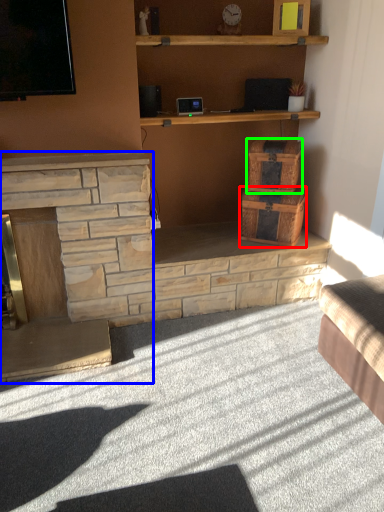
Question: Estimate the real-world distances between objects in this image. Which object is farther from drawer (highlighted by a red box), fireplace (highlighted by a blue box) or crate (highlighted by a green box)?

Choices:
 (A) fireplace
 (B) crate

Answer: (A)